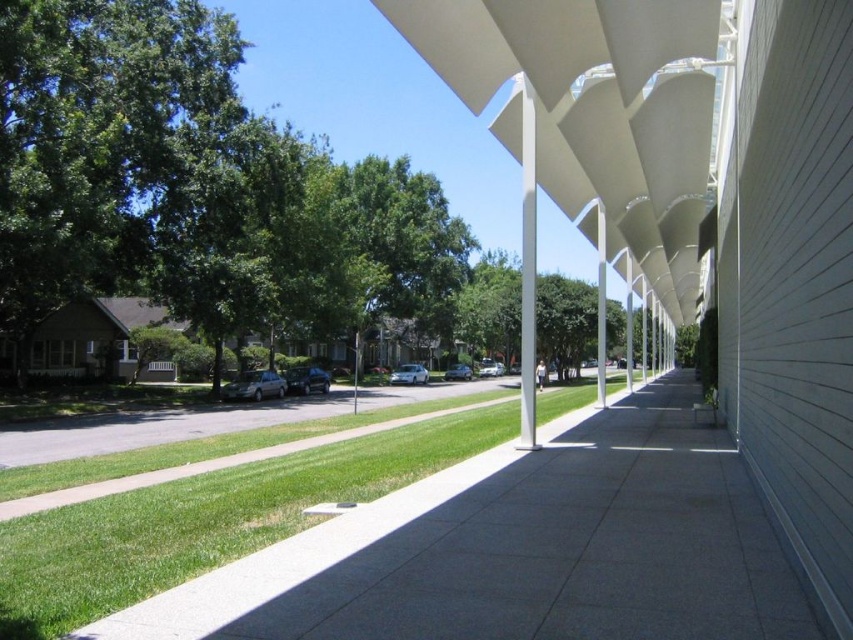
Question: Which object is closer to the camera taking this photo?

Choices:
 (A) green grass at center
 (B) white matte awning at center

Answer: (A)

Question: Is white matte awning at center above green grass at center?

Choices:
 (A) yes
 (B) no

Answer: (A)

Question: Does white matte awning at center come behind green grass at center?

Choices:
 (A) no
 (B) yes

Answer: (B)

Question: Which object appears farthest from the camera in this image?

Choices:
 (A) green grass at center
 (B) white matte awning at center

Answer: (B)

Question: Among these points, which one is farthest from the camera?

Choices:
 (A) (589, 180)
 (B) (248, 467)

Answer: (A)

Question: Is white matte awning at center thinner than green grass at center?

Choices:
 (A) no
 (B) yes

Answer: (A)